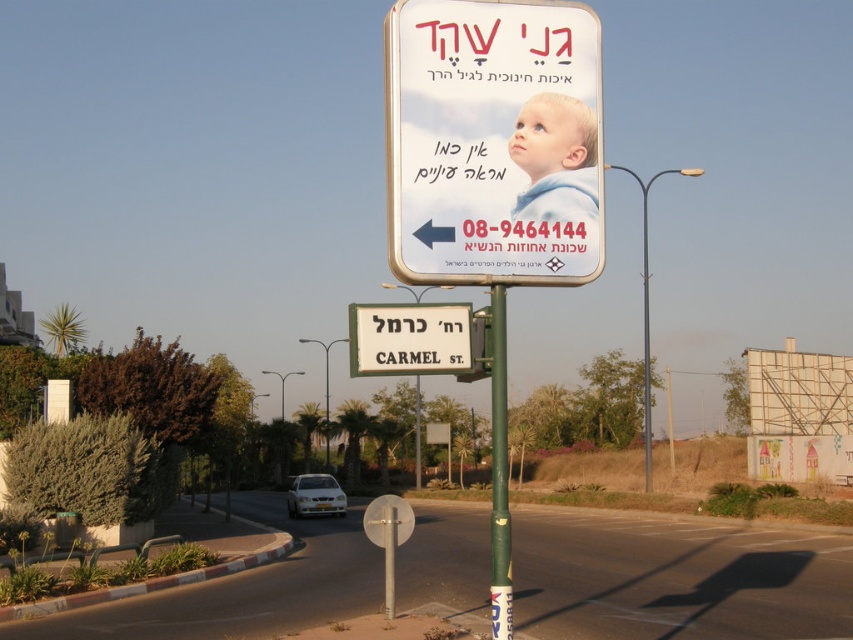
Does point (553, 276) lie behind point (469, 352)?

No, (553, 276) is closer to viewer.

Which is below, matte plastic sign at upper center or white plastic street sign at center?

white plastic street sign at center is below.

Who is more distant from viewer, [422,115] or [461,336]?

Point [461,336]

Locate an element on the screen. This screenshot has height=640, width=853. matte plastic sign at upper center is located at coordinates (492, 141).

Is point (450, 93) positioned after point (585, 140)?

No, it is not.

Is matte plastic sign at upper center bigger than light blue fabric baby at upper center?

Correct, matte plastic sign at upper center is larger in size than light blue fabric baby at upper center.

Does point (428, 48) lie in front of point (546, 109)?

That is True.

Where is `matte plastic sign at upper center`? matte plastic sign at upper center is located at coordinates (492, 141).

Is white plastic street sign at center above green painted metal pole at center?

Indeed, white plastic street sign at center is positioned over green painted metal pole at center.

Does point (437, 314) come closer to viewer compared to point (491, 500)?

Yes.

Find the location of `white plastic street sign at center`. white plastic street sign at center is located at coordinates (410, 339).